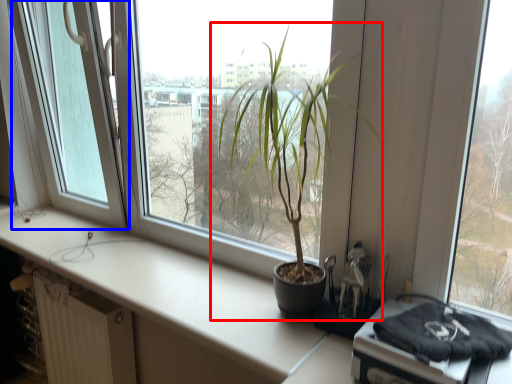
Question: Which object is closer to the camera taking this photo, houseplant (highlighted by a red box) or glass door (highlighted by a blue box)?

Choices:
 (A) houseplant
 (B) glass door

Answer: (A)